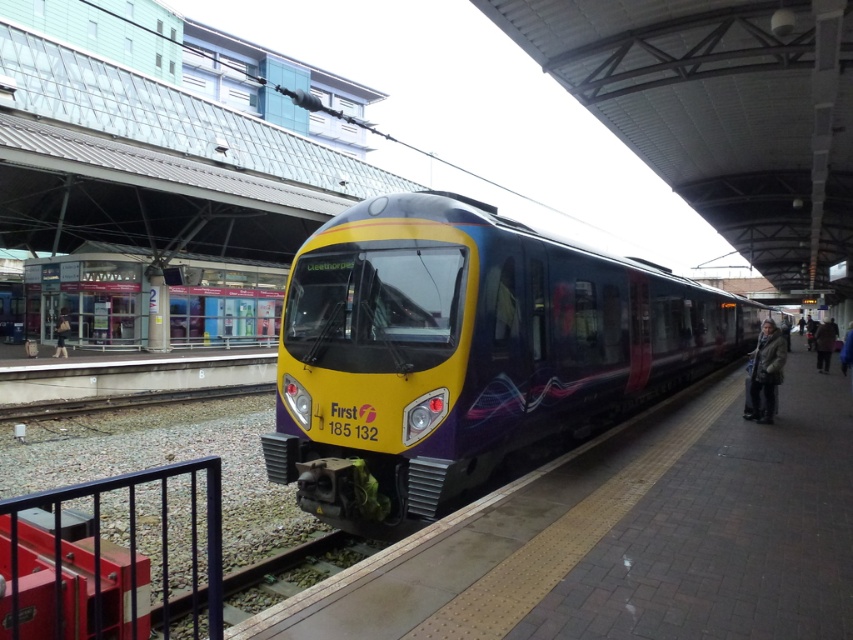
Describe the element at coordinates (764, 372) in the screenshot. I see `brown woolen coat at right` at that location.

Does brown woolen coat at right have a lesser height compared to dark brown leather jacket at right?

Incorrect, brown woolen coat at right's height does not fall short of dark brown leather jacket at right's.

Is point (753, 371) positioned before point (827, 333)?

Yes, it is in front of point (827, 333).

This screenshot has width=853, height=640. In order to click on brown woolen coat at right in this screenshot , I will do `click(764, 372)`.

Does point (370, 570) come closer to viewer compared to point (759, 360)?

Yes, it is in front of point (759, 360).

Looking at this image, who is positioned more to the right, purple glossy platform at center or brown woolen coat at right?

brown woolen coat at right

Where is `purple glossy platform at center`? This screenshot has height=640, width=853. purple glossy platform at center is located at coordinates (627, 538).

Can you confirm if dark gray jacket at left is positioned below blue fabric jacket at right?

No.

Who is lower down, dark gray jacket at left or blue fabric jacket at right?

blue fabric jacket at right is below.

Does point (57, 339) come farther from viewer compared to point (845, 342)?

Yes.

The width and height of the screenshot is (853, 640). What are the coordinates of `dark gray jacket at left` in the screenshot? It's located at (61, 332).